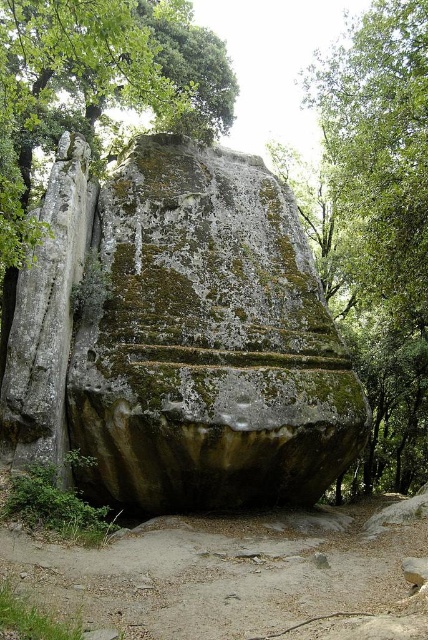
You are a hiker who wants to climb the green mossy rock at center and the green mossy rock at upper center. Which rock should you climb first to reach the higher elevation?

You should climb the green mossy rock at upper center first because it is positioned higher than the green mossy rock at center, which is located below it.

You are a hiker trying to navigate around the green mossy rock at center and the green mossy rock at upper center. Which rock should you go around to stay on the path that leads to the right side of the image?

You should go around the green mossy rock at upper center first because the green mossy rock at center is to its right, so moving around the upper center rock keeps you on the path leading to the right.